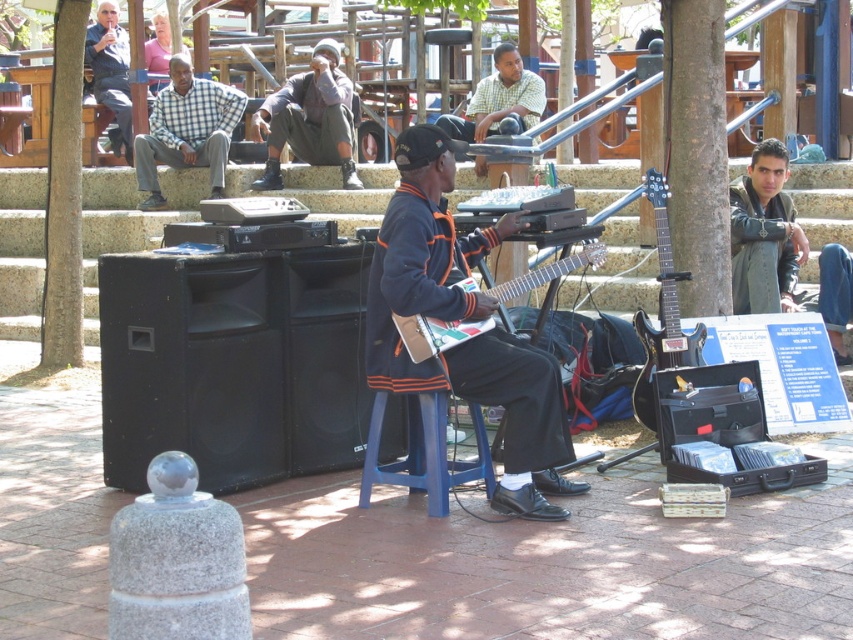
You are standing in front of the street musician and want to place a small flower pot between the two points labeled as point (503, 352) and point (122, 97). Can you determine which point is closer to you where you should place the flower pot?

Answer: Point (503, 352) is closer to the viewer than point (122, 97), so you should place the flower pot near point (503, 352) since it is closer to you.

You are a passerby observing the street musician. The orange fabric jacket at center and the matte black jacket at upper left are both visible. Which jacket appears shorter in height?

The orange fabric jacket at center has a lesser height compared to matte black jacket at upper left, so the orange fabric jacket at center appears shorter.